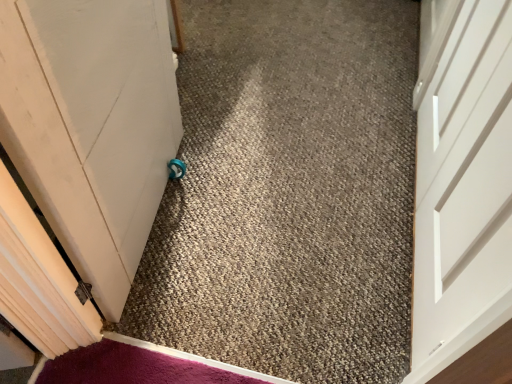
Question: Should I look upward or downward to see white matte door at center?

Choices:
 (A) up
 (B) down

Answer: (A)